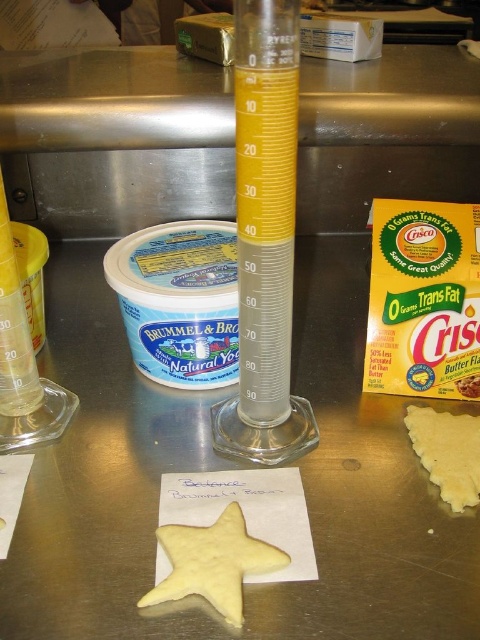
This screenshot has width=480, height=640. What do you see at coordinates (447, 452) in the screenshot?
I see `yellow matte dough at lower right` at bounding box center [447, 452].

Which is above, yellow matte dough at lower right or butter-flavored shortening at center?

butter-flavored shortening at center is higher up.

Which is in front, point (463, 445) or point (472, 385)?

Point (463, 445) is more forward.

You are a GUI agent. You are given a task and a screenshot of the screen. Output one action in this format:
    pyautogui.click(x=<x>, y=<y>)
    Task: Click on the yellow matte dough at lower right
    
    Given the screenshot: What is the action you would take?
    pyautogui.click(x=447, y=452)

Between yellow matte star-shaped dough at center and yellow matte dough at lower right, which one appears on the left side from the viewer's perspective?

yellow matte star-shaped dough at center

Does yellow matte star-shaped dough at center have a smaller size compared to yellow matte dough at lower right?

No.

Where is `yellow matte star-shaped dough at center`? This screenshot has width=480, height=640. yellow matte star-shaped dough at center is located at coordinates (213, 563).

Is yellow matte star-shaped dough at center thinner than butter-flavored shortening at center?

No, yellow matte star-shaped dough at center is not thinner than butter-flavored shortening at center.

Is yellow matte star-shaped dough at center shorter than butter-flavored shortening at center?

No.

The width and height of the screenshot is (480, 640). I want to click on yellow matte star-shaped dough at center, so click(x=213, y=563).